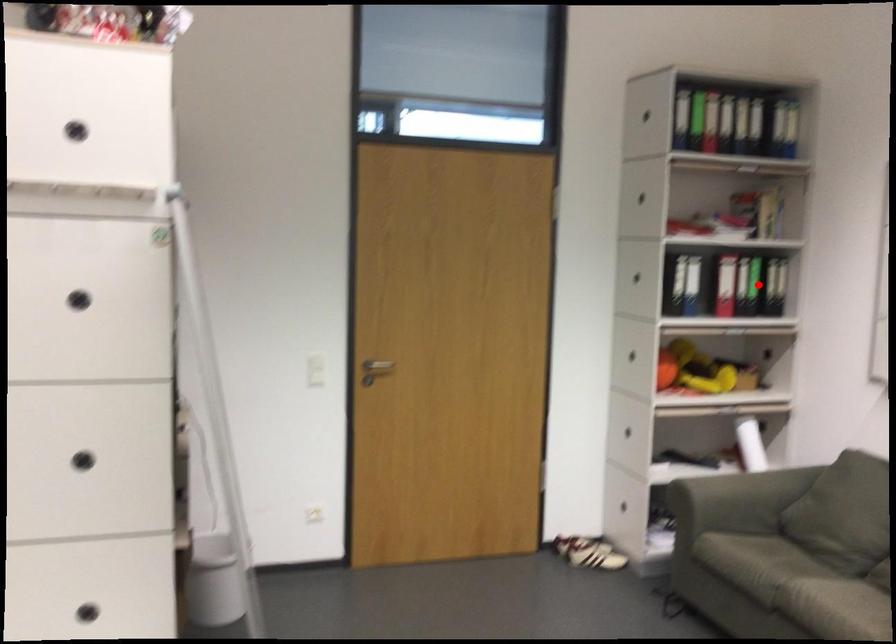
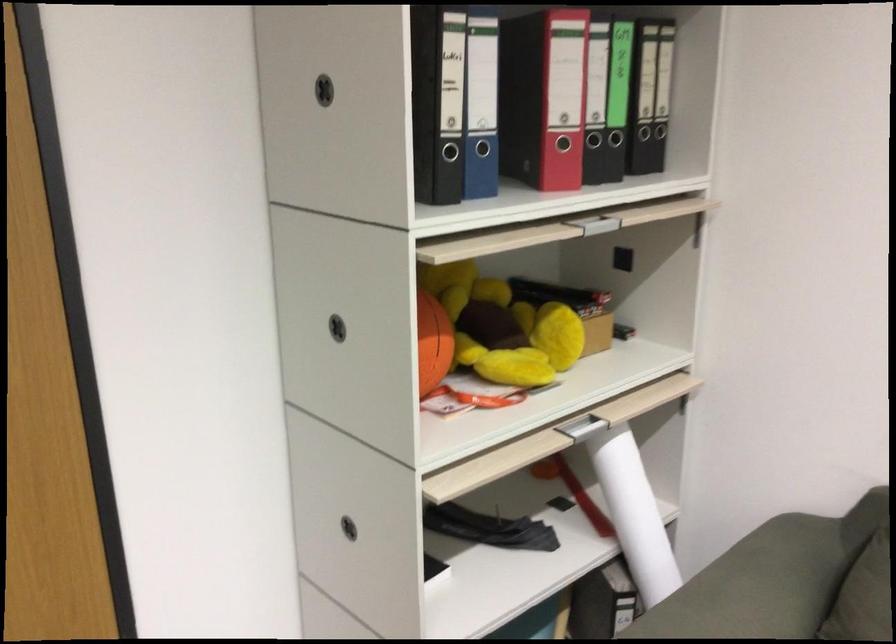
Question: I am providing you with two images of the same scene from different viewpoints. A red point is marked on the first image. Is the red point's position out of view in image 2?

Choices:
 (A) Yes
 (B) No

Answer: (A)